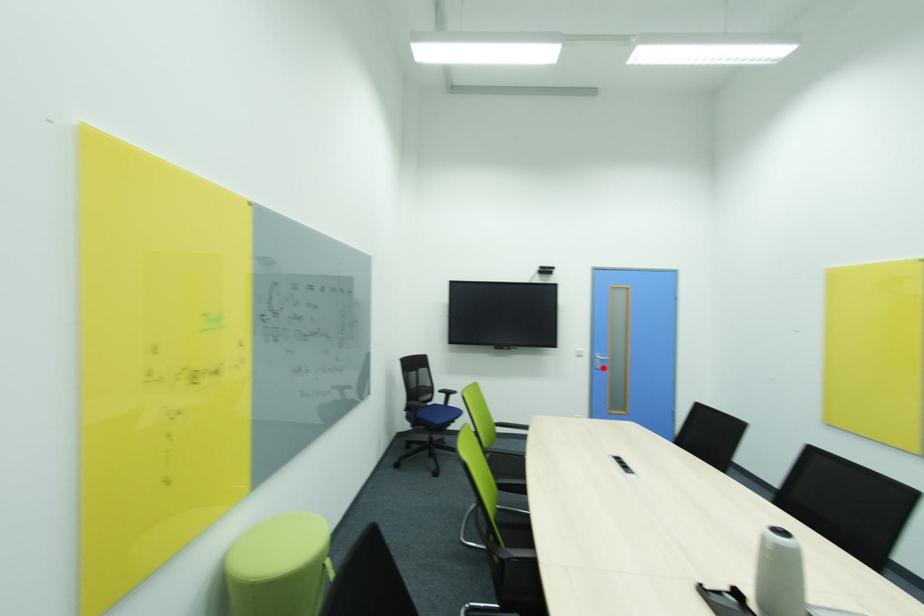
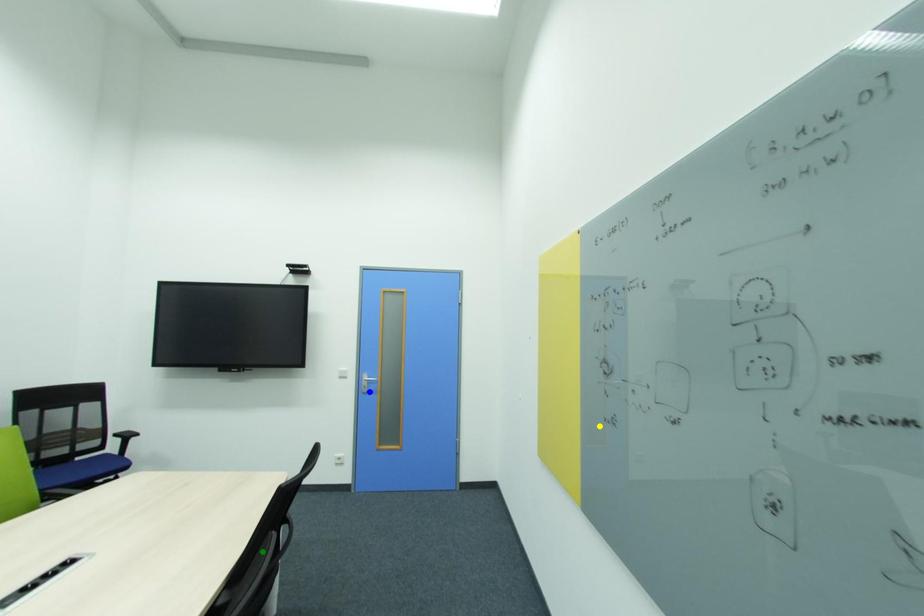
Question: I am providing you with two images of the same scene from different viewpoints. A red point is marked on the first image. You are given multiple points on the second image. Can you choose the point in image 2 that corresponds to the point in image 1?

Choices:
 (A) yellow point
 (B) green point
 (C) blue point

Answer: (C)